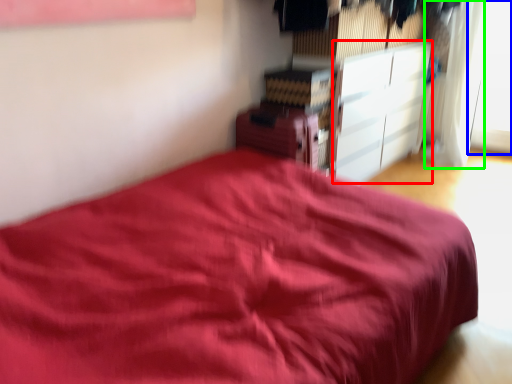
Question: Which object is the closest to the cabinetry (highlighted by a red box)? Choose among these: window (highlighted by a blue box) or curtain (highlighted by a green box).

Choices:
 (A) window
 (B) curtain

Answer: (B)